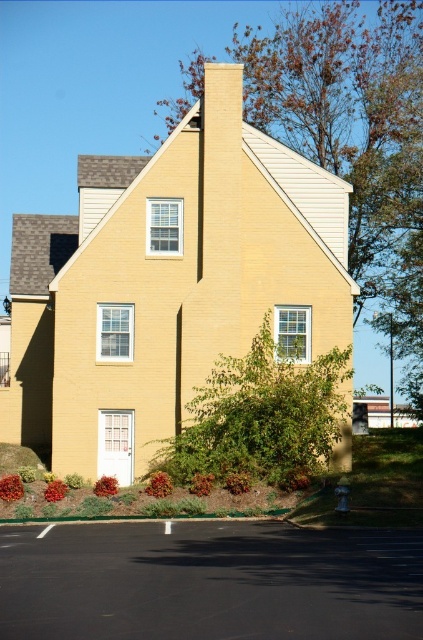
Question: Does green leafy tree at center appear over green leafy bush at center?

Choices:
 (A) no
 (B) yes

Answer: (B)

Question: Is green leafy tree at center to the left of green leafy bush at center from the viewer's perspective?

Choices:
 (A) no
 (B) yes

Answer: (A)

Question: Is green leafy tree at center to the right of green leafy bush at center from the viewer's perspective?

Choices:
 (A) no
 (B) yes

Answer: (B)

Question: Which point appears farthest from the camera in this image?

Choices:
 (A) (282, 116)
 (B) (260, 419)

Answer: (A)

Question: Which point appears farthest from the camera in this image?

Choices:
 (A) [337, 93]
 (B) [277, 364]

Answer: (A)